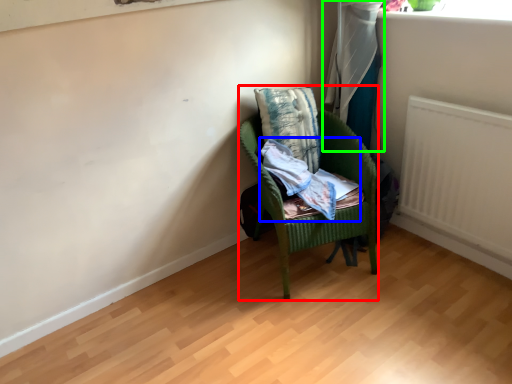
Question: Based on their relative distances, which object is farther from chair (highlighted by a red box)? Choose from clothing (highlighted by a blue box) and curtain (highlighted by a green box).

Choices:
 (A) clothing
 (B) curtain

Answer: (B)